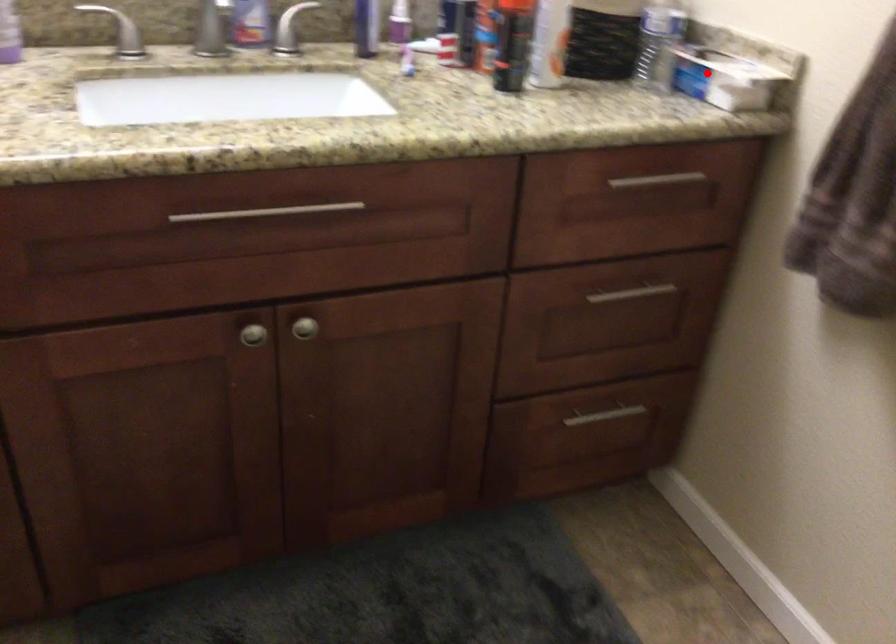
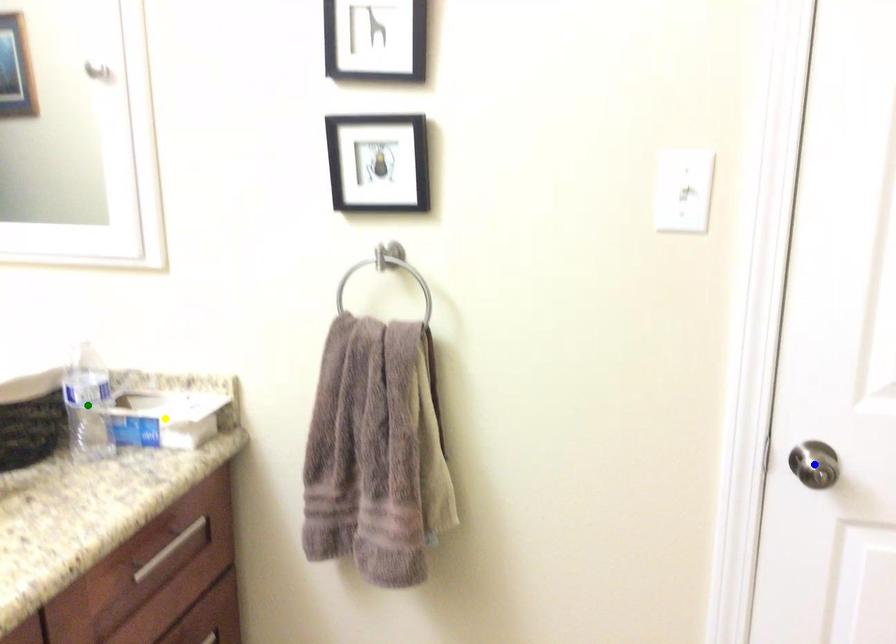
Question: I am providing you with two images of the same scene from different viewpoints. A red point is marked on the first image. You are given multiple points on the second image. Which point in image 2 represents the same 3d spot as the red point in image 1?

Choices:
 (A) blue point
 (B) yellow point
 (C) green point

Answer: (B)